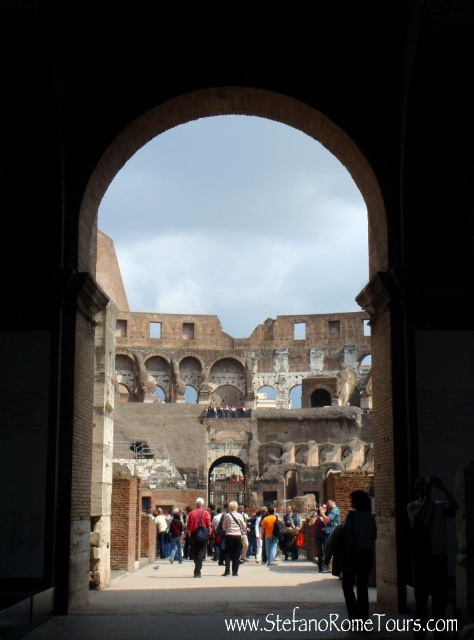
Who is shorter, red fabric backpack at center or orange cotton shirt at center?

Standing shorter between the two is orange cotton shirt at center.

This screenshot has height=640, width=474. I want to click on red fabric backpack at center, so click(x=198, y=532).

Which is behind, point (199, 556) or point (264, 531)?

Positioned behind is point (264, 531).

Identify the location of red fabric backpack at center. click(198, 532).

From the picture: Does dark blue fabric backpack at center appear over orange cotton shirt at center?

Indeed, dark blue fabric backpack at center is positioned over orange cotton shirt at center.

Who is more distant from viewer, (342, 531) or (267, 508)?

The point (267, 508) is more distant.

Identify the location of dark blue fabric backpack at center. This screenshot has height=640, width=474. (x=355, y=554).

This screenshot has width=474, height=640. I want to click on dark blue fabric backpack at center, so click(355, 554).

Does dark blue fabric backpack at center appear under red fabric backpack at center?

Incorrect, dark blue fabric backpack at center is not positioned below red fabric backpack at center.

Measure the distance between point (355, 589) and camera.

185.46 feet

Locate an element on the screen. The image size is (474, 640). dark blue fabric backpack at center is located at coordinates (x=355, y=554).